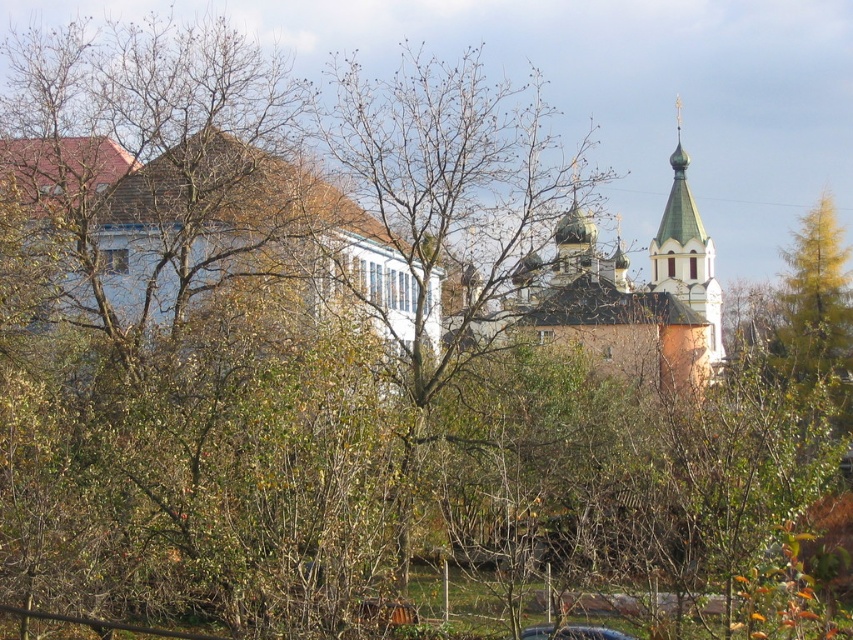
Question: Does white matte building at left appear on the right side of green metallic church at upper right?

Choices:
 (A) yes
 (B) no

Answer: (B)

Question: Which object appears closest to the camera in this image?

Choices:
 (A) green metallic church at upper right
 (B) white matte building at left
 (C) green painted wood tower at upper right

Answer: (B)

Question: Which is nearer to the green painted wood tower at upper right?

Choices:
 (A) green metallic church at upper right
 (B) white matte building at left

Answer: (A)

Question: Can you confirm if green metallic church at upper right is positioned above green painted wood tower at upper right?

Choices:
 (A) no
 (B) yes

Answer: (B)

Question: Is white matte building at left above green painted wood tower at upper right?

Choices:
 (A) yes
 (B) no

Answer: (B)

Question: Which point appears closest to the camera in this image?

Choices:
 (A) (286, 161)
 (B) (675, 246)

Answer: (A)